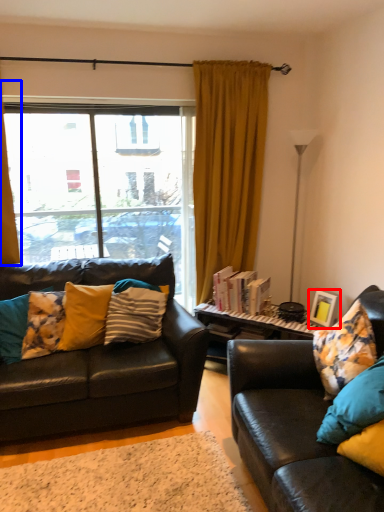
Question: Which object appears closest to the camera in this image, picture frame (highlighted by a red box) or curtain (highlighted by a blue box)?

Choices:
 (A) picture frame
 (B) curtain

Answer: (B)